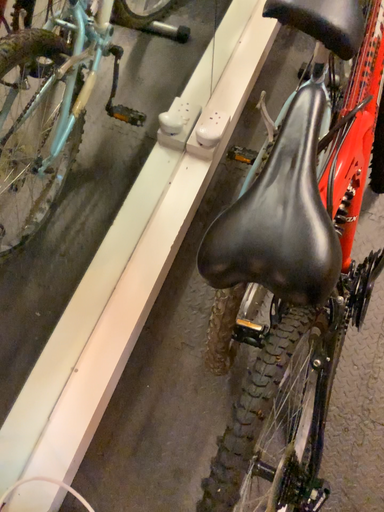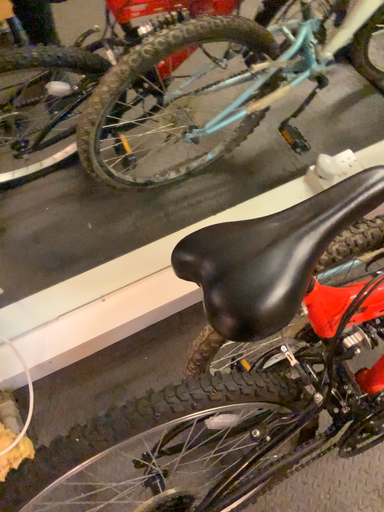
Question: How did the camera likely rotate when shooting the video?

Choices:
 (A) rotated right
 (B) rotated left

Answer: (B)